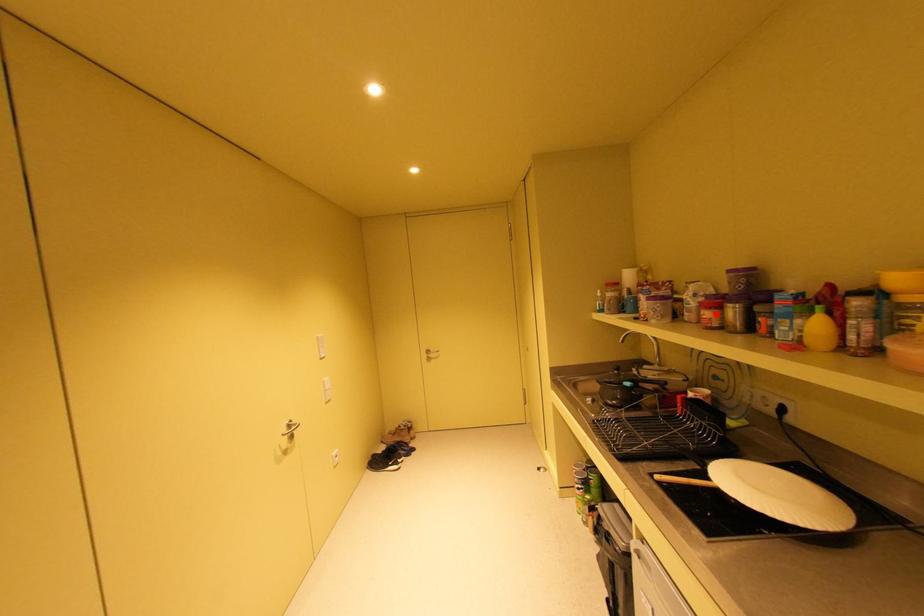
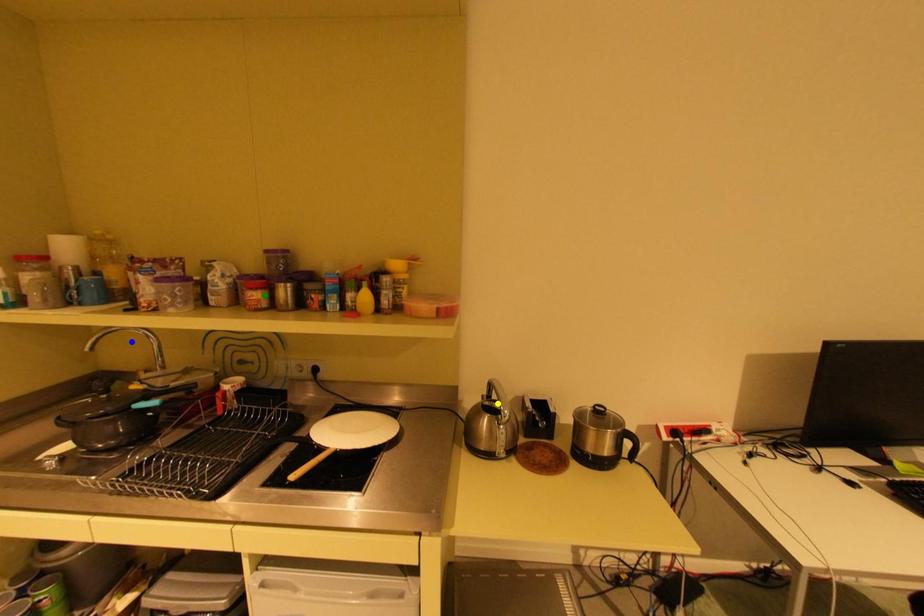
Question: I am providing you with two images of the same scene from different viewpoints. A red point is marked on the first image. You are given multiple points on the second image. In image 2, which mark is for the same physical point as the one in image 1?

Choices:
 (A) yellow point
 (B) blue point
 (C) green point

Answer: (C)